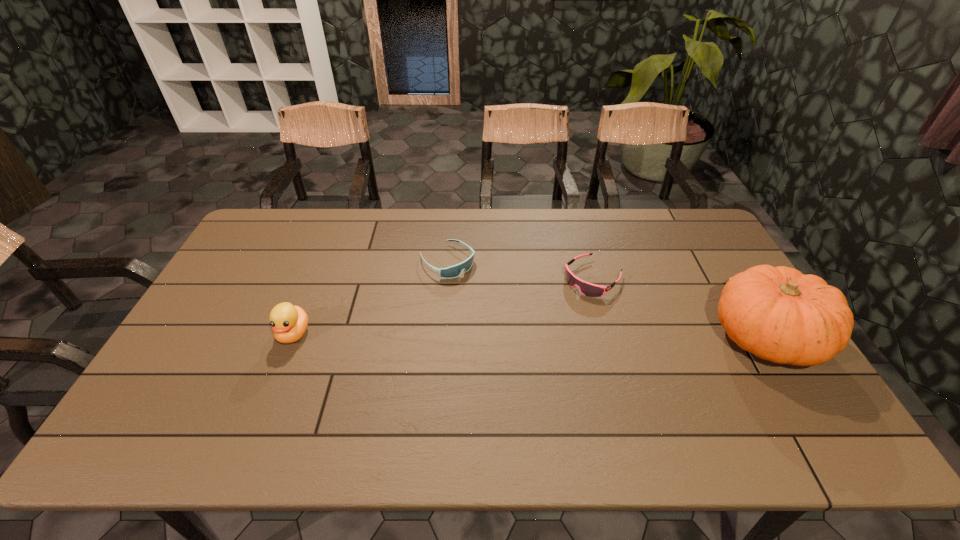
You are a GUI agent. You are given a task and a screenshot of the screen. Output one action in this format:
    pyautogui.click(x=<x>, y=<y>)
    Task: Click on the free region located on the front-facing side of the left goggles
    
    Given the screenshot: What is the action you would take?
    pyautogui.click(x=539, y=341)

The height and width of the screenshot is (540, 960). In order to click on blank area located on the front-facing side of the right goggles in this screenshot , I will do `click(539, 324)`.

At what (x,y) coordinates should I click in order to perform the action: click on free region located 0.390m on the front-facing side of the right goggles. Please return your answer as a coordinate pair (x, y). Image resolution: width=960 pixels, height=540 pixels. Looking at the image, I should click on (487, 367).

You are a GUI agent. You are given a task and a screenshot of the screen. Output one action in this format:
    pyautogui.click(x=<x>, y=<y>)
    Task: Click on the free point located 0.060m on the front-facing side of the right goggles
    This screenshot has height=540, width=960.
    Given the screenshot: What is the action you would take?
    pyautogui.click(x=564, y=302)

Image resolution: width=960 pixels, height=540 pixels. In order to click on object positioned at the far edge in this screenshot , I will do `click(454, 271)`.

Find the location of a particular element. This screenshot has width=960, height=540. object located at the near edge is located at coordinates (777, 313).

Identify the location of object located in the right edge section of the desktop. (777, 313).

Find the location of a particular element. This screenshot has height=540, width=960. object located at the near right corner is located at coordinates coord(777,313).

Find the location of `free space at the far edge`. free space at the far edge is located at coordinates (568, 208).

At what (x,y) coordinates should I click in order to perform the action: click on vacant space at the near edge of the desktop. Please return your answer as a coordinate pair (x, y). This screenshot has width=960, height=540. Looking at the image, I should click on (449, 393).